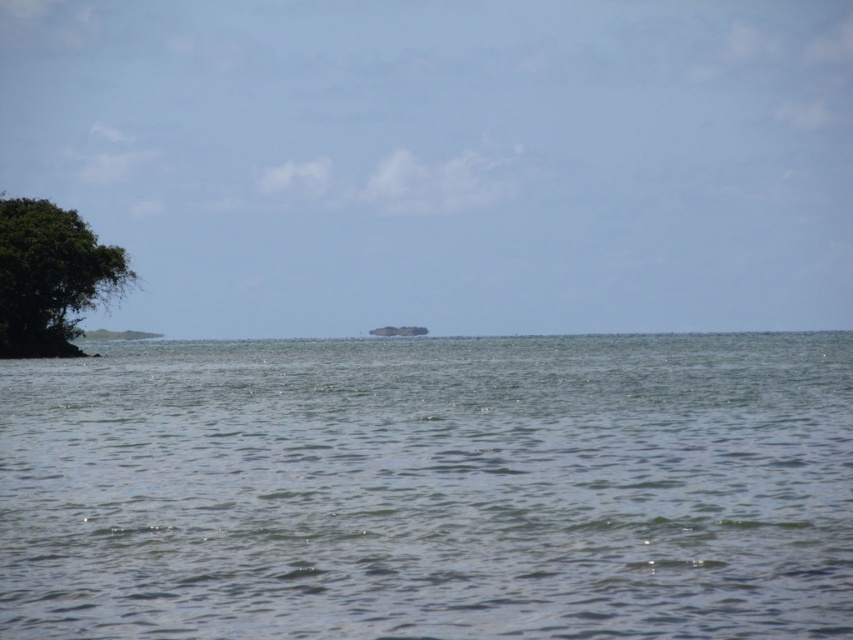
You are standing on the shore looking at the clear water at center and the green leafy tree at left. Which object appears taller from your perspective?

The green leafy tree at left appears taller than the clear water at center from your perspective.

In the scene shown: You are standing on the beach and see the green leafy tree at left and the green grassy island at center. Which one is taller?

The green leafy tree at left is taller than the green grassy island at center.

You are standing on the shore looking at the clear water at center and the green grassy island at center. Which object is closer to you?

The clear water at center is closer to the viewer than the green grassy island at center.